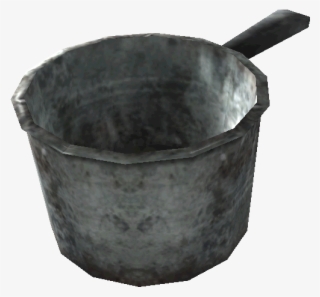
The image size is (320, 297). In order to click on curved lines on the inside of the cup in this screenshot , I will do `click(63, 115)`, `click(137, 92)`, `click(200, 99)`, `click(68, 99)`, `click(124, 81)`, `click(196, 83)`, `click(224, 104)`.